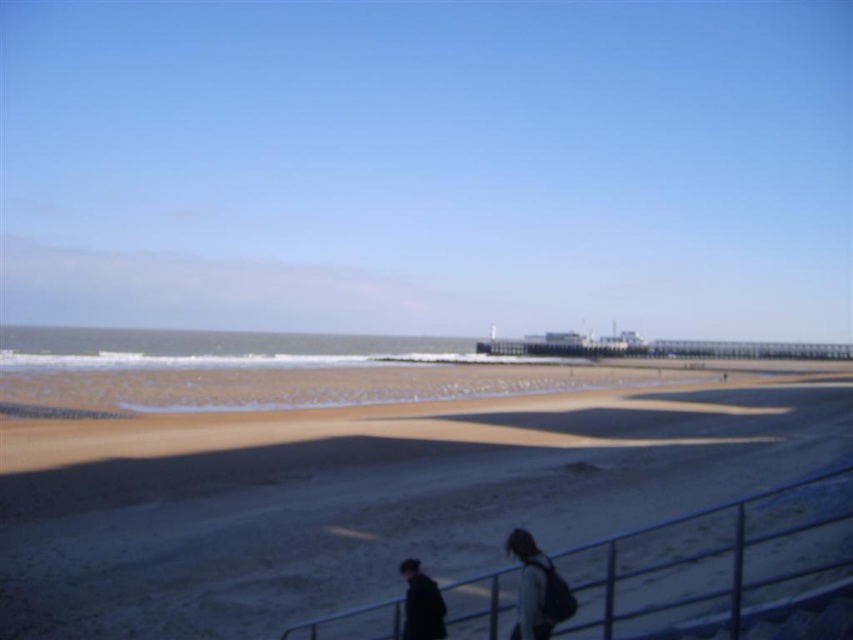
You are standing on the beach and see the metallic silver railing at lower center and the dark blue fabric jacket at lower center. Which object is positioned to the right from your perspective?

The metallic silver railing at lower center is to the right of the dark blue fabric jacket at lower center.

You are standing on the brown sandy beach at lower center and want to pick up the dark blue fabric jacket at lower center. Is the jacket closer to you or further away?

The dark blue fabric jacket at lower center is further away from you since the brown sandy beach at lower center is closer to the viewer.